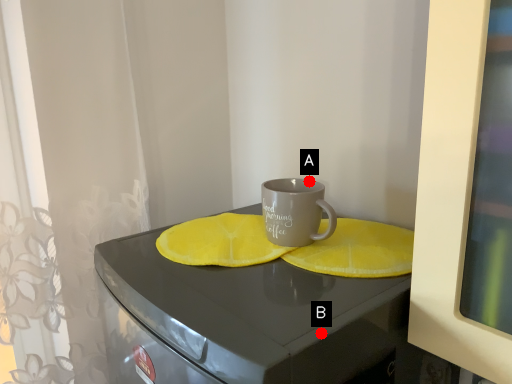
Question: Two points are circled on the image, labeled by A and B beside each circle. Which point is further to the camera?

Choices:
 (A) A is further
 (B) B is further

Answer: (A)